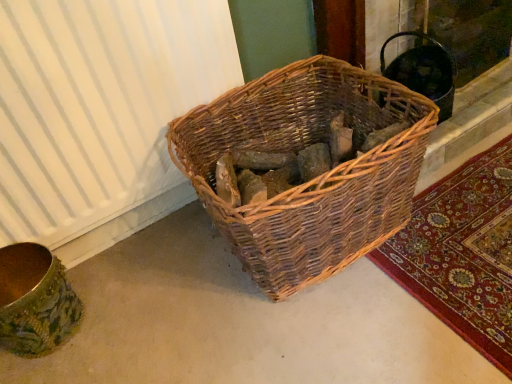
In order to click on free space in front of woven brown basket at center in this screenshot , I will do `click(358, 328)`.